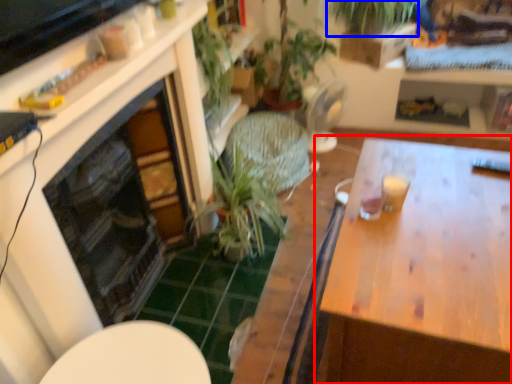
Question: Which point is closer to the camera, table (highlighted by a red box) or vegetation (highlighted by a blue box)?

Choices:
 (A) table
 (B) vegetation

Answer: (A)